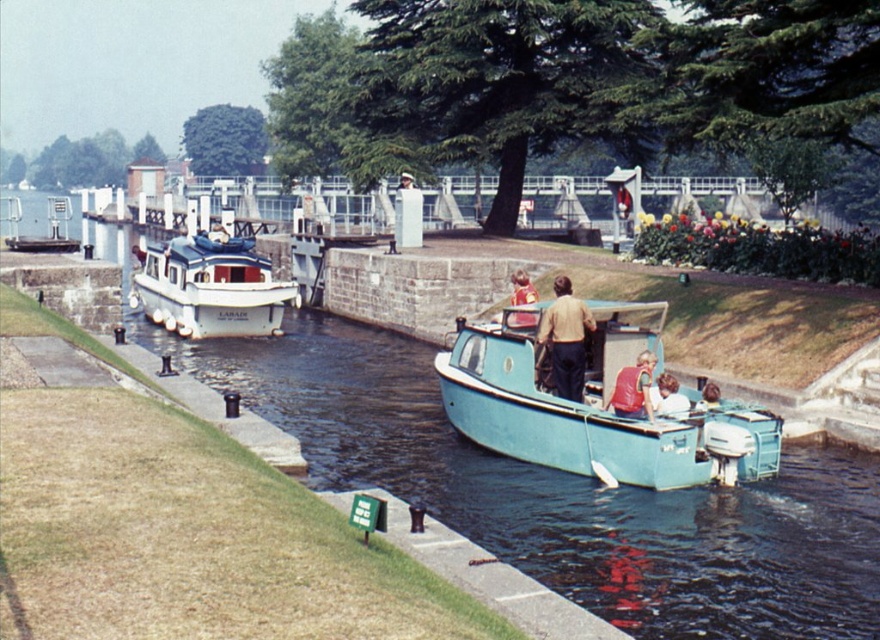
Is the position of light blue fabric shirt at center more distant than that of light brown wooden boat at lower right?

No, it is in front of light brown wooden boat at lower right.

Between light blue fabric shirt at center and light brown wooden boat at lower right, which one is positioned lower?

light brown wooden boat at lower right is lower down.

Where is `light blue fabric shirt at center`? Image resolution: width=880 pixels, height=640 pixels. light blue fabric shirt at center is located at coordinates (668, 397).

Image resolution: width=880 pixels, height=640 pixels. I want to click on light blue fabric shirt at center, so click(668, 397).

Who is lower down, blue glossy boat at center or white glossy boat at left?

blue glossy boat at center is below.

Between blue glossy boat at center and white glossy boat at left, which one has less height?

white glossy boat at left is shorter.

The image size is (880, 640). I want to click on blue glossy boat at center, so click(x=560, y=490).

Which is above, blue glossy boat at center or light brown wooden boat at lower right?

Positioned higher is blue glossy boat at center.

Based on the photo, does blue glossy boat at center have a smaller size compared to light brown wooden boat at lower right?

No, blue glossy boat at center is not smaller than light brown wooden boat at lower right.

Locate an element on the screen. The height and width of the screenshot is (640, 880). blue glossy boat at center is located at coordinates (560, 490).